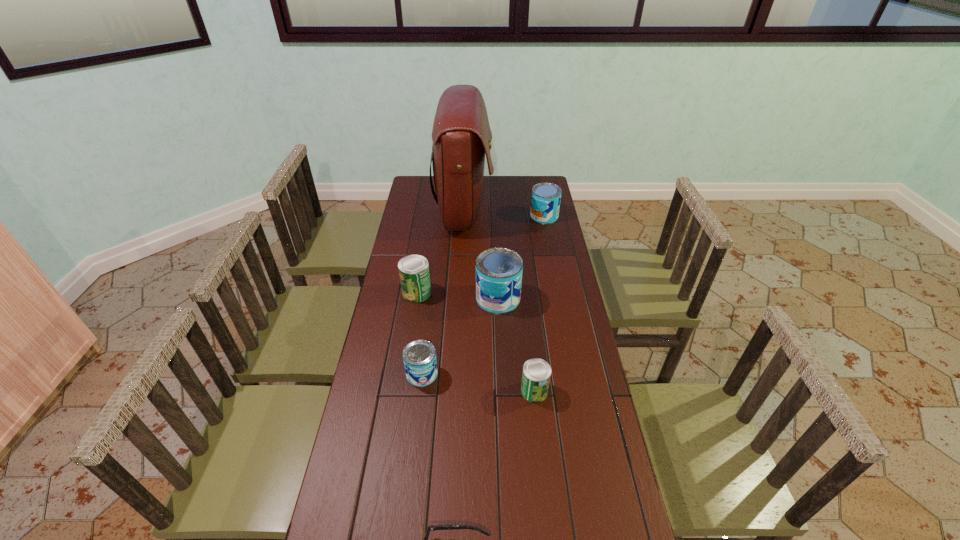
The width and height of the screenshot is (960, 540). In order to click on the right green can in this screenshot , I will do `click(536, 375)`.

The image size is (960, 540). I want to click on the smaller green can, so click(536, 375).

Image resolution: width=960 pixels, height=540 pixels. I want to click on free space located on the open flap of the brown satchel, so click(x=520, y=208).

Where is `free space located on the back of the biggest blue can`? free space located on the back of the biggest blue can is located at coordinates (495, 245).

The width and height of the screenshot is (960, 540). Find the location of `vacant space located on the back of the farthest blue can`. vacant space located on the back of the farthest blue can is located at coordinates coord(538,185).

The height and width of the screenshot is (540, 960). I want to click on vacant space located 0.180m on the right of the left green can, so click(x=477, y=292).

Locate an element on the screen. This screenshot has width=960, height=540. free spot located on the right of the nearest blue can is located at coordinates (530, 374).

Locate an element on the screen. This screenshot has width=960, height=540. vacant position located 0.280m on the left of the right green can is located at coordinates [431, 391].

This screenshot has height=540, width=960. Find the location of `object at the far edge`. object at the far edge is located at coordinates (461, 134).

Locate an element on the screen. The width and height of the screenshot is (960, 540). satchel that is at the left edge is located at coordinates pos(461,134).